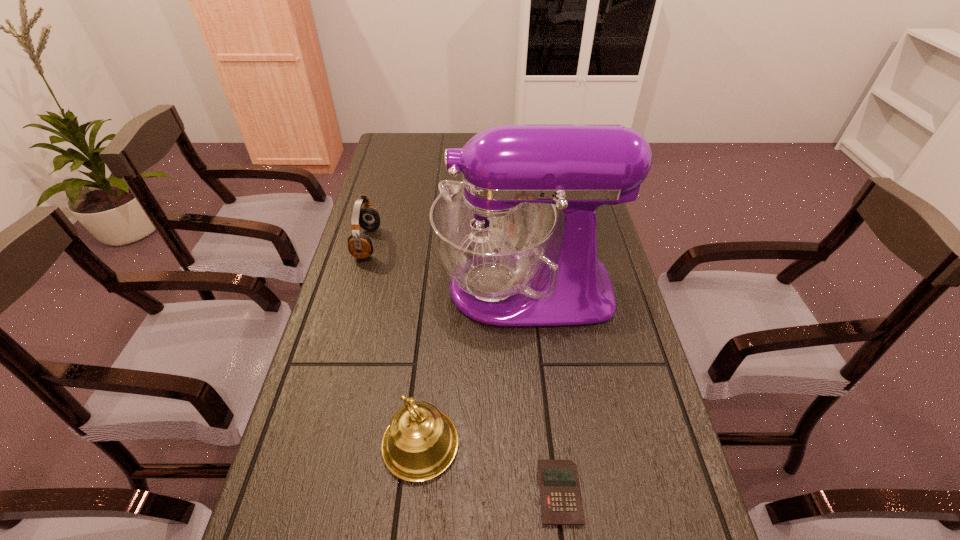
Image resolution: width=960 pixels, height=540 pixels. I want to click on vacant space that satisfies the following two spatial constraints: 1. on the ear cups of the headset; 2. on the right side of the bell, so click(x=311, y=444).

I want to click on vacant position in the image that satisfies the following two spatial constraints: 1. on the ear cups of the third tallest object; 2. on the right side of the calculator, so click(x=298, y=492).

Locate an element on the screen. Image resolution: width=960 pixels, height=540 pixels. vacant space that satisfies the following two spatial constraints: 1. at the bowl opening of the tallest object; 2. on the left side of the calculator is located at coordinates (544, 492).

The width and height of the screenshot is (960, 540). I want to click on vacant position in the image that satisfies the following two spatial constraints: 1. on the front side of the calculator; 2. on the right side of the third shortest object, so click(416, 492).

Where is `vacant area that satisfies the following two spatial constraints: 1. on the front side of the shortest object; 2. on the left side of the second tallest object`? vacant area that satisfies the following two spatial constraints: 1. on the front side of the shortest object; 2. on the left side of the second tallest object is located at coordinates (416, 492).